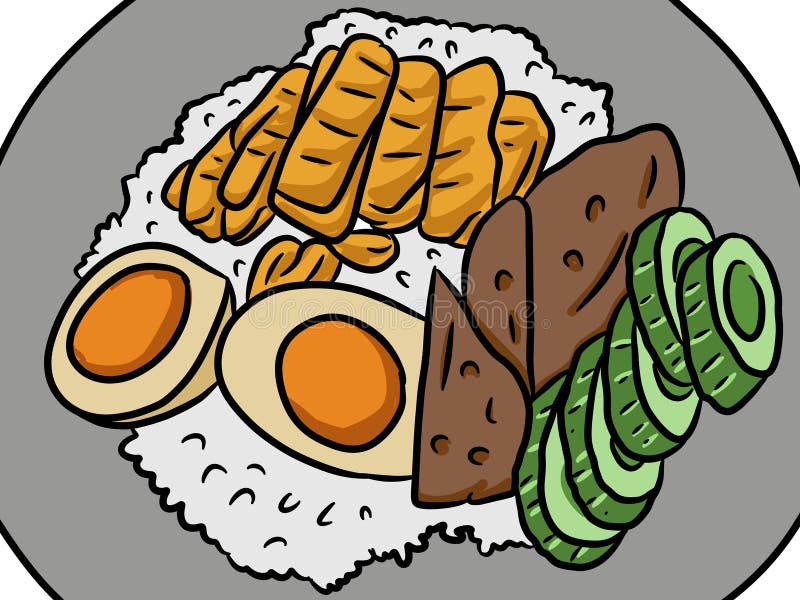
Identify the location of grey round plate. (712, 500), (710, 112), (66, 588), (133, 46).